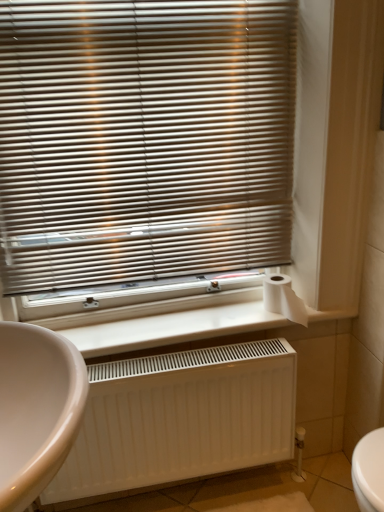
Question: Considering the relative sizes of white matte radiator at lower center and white matte radiator at lower center in the image provided, is white matte radiator at lower center shorter than white matte radiator at lower center?

Choices:
 (A) no
 (B) yes

Answer: (B)

Question: From a real-world perspective, is white matte radiator at lower center positioned under white matte radiator at lower center based on gravity?

Choices:
 (A) no
 (B) yes

Answer: (A)

Question: Is there a large distance between white matte radiator at lower center and white matte radiator at lower center?

Choices:
 (A) no
 (B) yes

Answer: (A)

Question: Can you confirm if white matte radiator at lower center is thinner than white matte radiator at lower center?

Choices:
 (A) yes
 (B) no

Answer: (B)

Question: Is white matte radiator at lower center bigger than white matte radiator at lower center?

Choices:
 (A) no
 (B) yes

Answer: (A)

Question: Is metallic blinds at upper center in front of or behind beige glossy sink at lower left in the image?

Choices:
 (A) behind
 (B) front

Answer: (A)

Question: In terms of width, does metallic blinds at upper center look wider or thinner when compared to beige glossy sink at lower left?

Choices:
 (A) thin
 (B) wide

Answer: (A)

Question: Which is correct: metallic blinds at upper center is inside beige glossy sink at lower left, or outside of it?

Choices:
 (A) outside
 (B) inside

Answer: (A)

Question: In terms of height, does metallic blinds at upper center look taller or shorter compared to beige glossy sink at lower left?

Choices:
 (A) short
 (B) tall

Answer: (B)

Question: Considering the positions of metallic blinds at upper center and white matte radiator at lower center in the image, is metallic blinds at upper center taller or shorter than white matte radiator at lower center?

Choices:
 (A) tall
 (B) short

Answer: (A)

Question: From the image's perspective, relative to white matte radiator at lower center, is metallic blinds at upper center above or below?

Choices:
 (A) above
 (B) below

Answer: (A)

Question: From a real-world perspective, relative to white matte radiator at lower center, is metallic blinds at upper center vertically above or below?

Choices:
 (A) above
 (B) below

Answer: (A)

Question: Is point (142, 33) positioned closer to the camera than point (170, 314)?

Choices:
 (A) farther
 (B) closer

Answer: (B)

Question: Is point click(44, 457) positioned closer to the camera than point click(291, 322)?

Choices:
 (A) closer
 (B) farther

Answer: (A)

Question: In the image, is beige glossy sink at lower left positioned in front of or behind white matte radiator at lower center?

Choices:
 (A) front
 (B) behind

Answer: (A)